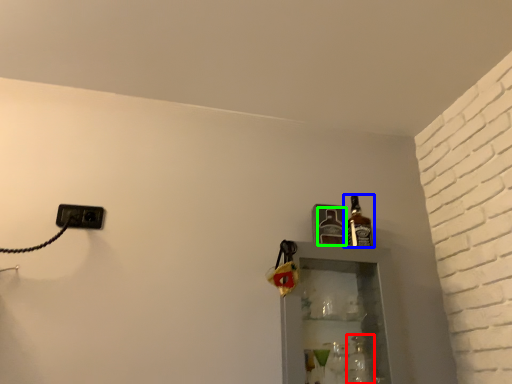
Question: Estimate the real-world distances between objects in this image. Which object is farther from bottle (highlighted by a red box), bottle (highlighted by a blue box) or bottle (highlighted by a green box)?

Choices:
 (A) bottle
 (B) bottle

Answer: (B)